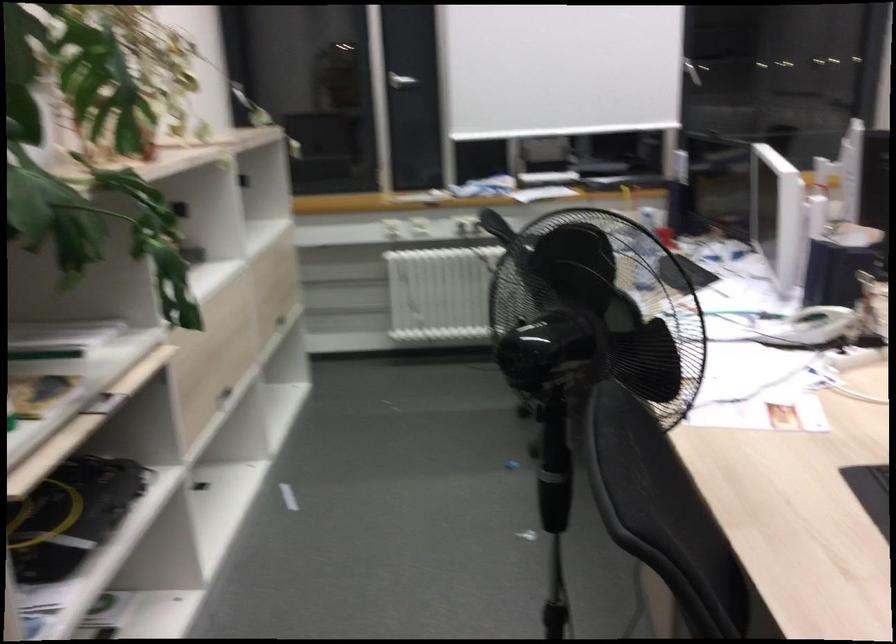
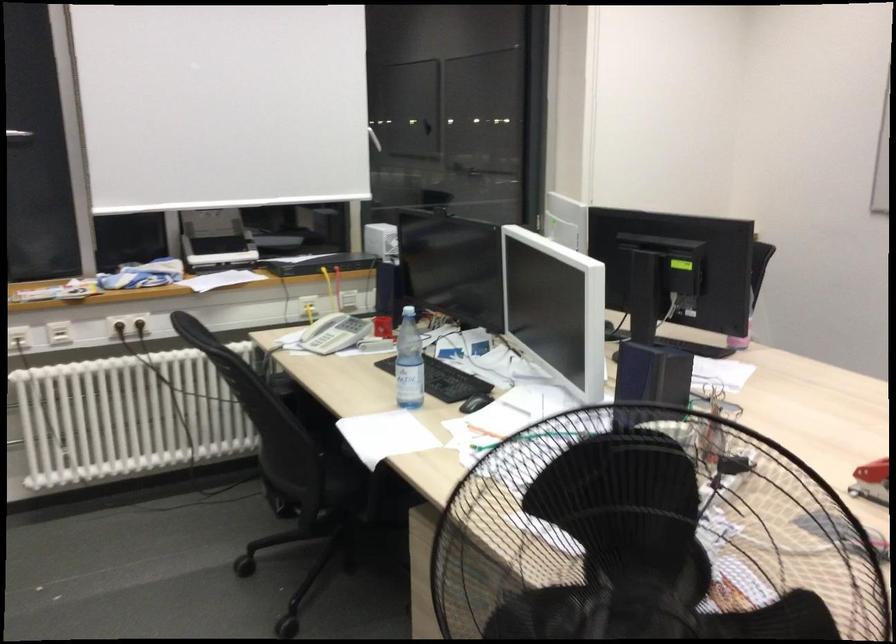
Which direction would the cameraman need to move to produce the second image?

The cameraman walked toward left, forward.